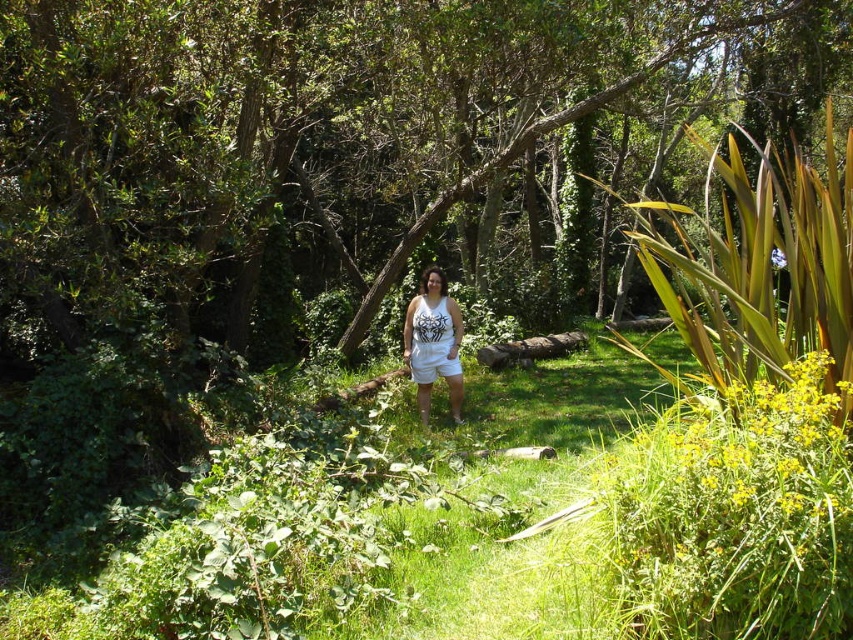
Question: Which of the following is the closest to the observer?

Choices:
 (A) (608, 609)
 (B) (410, 336)

Answer: (A)

Question: Which of the following is the farthest from the observer?

Choices:
 (A) (723, 467)
 (B) (451, 333)

Answer: (B)

Question: Does green grass at center have a smaller size compared to white cotton tank top at center?

Choices:
 (A) no
 (B) yes

Answer: (B)

Question: Is green grass at center bigger than white cotton tank top at center?

Choices:
 (A) yes
 (B) no

Answer: (B)

Question: Can you confirm if green grass at center is positioned to the right of white cotton tank top at center?

Choices:
 (A) no
 (B) yes

Answer: (A)